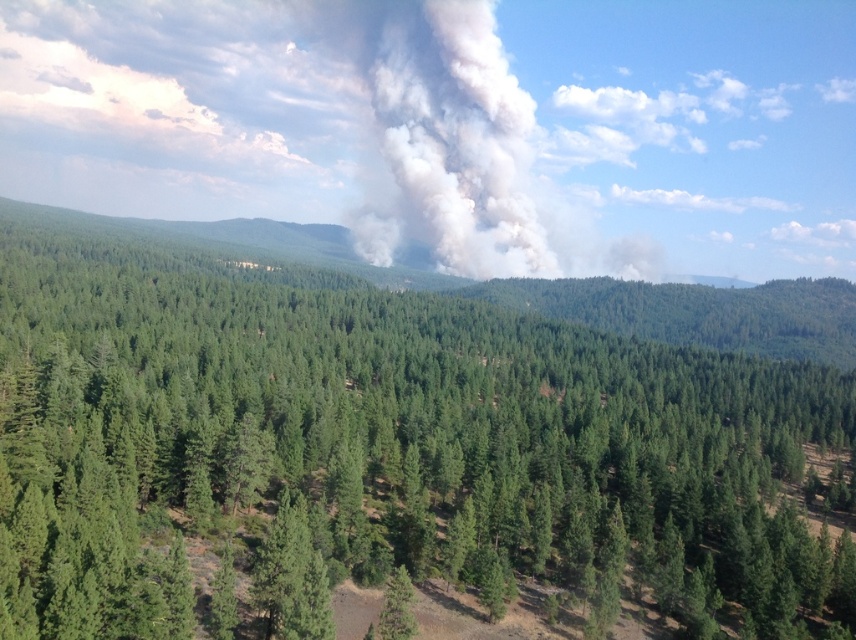
What do you see at coordinates (390, 452) in the screenshot?
I see `green matte tree at center` at bounding box center [390, 452].

Does green matte tree at center have a lesser height compared to green matte tree at lower center?

No.

What do you see at coordinates (390, 452) in the screenshot?
I see `green matte tree at center` at bounding box center [390, 452].

The height and width of the screenshot is (640, 856). I want to click on green matte tree at center, so click(x=390, y=452).